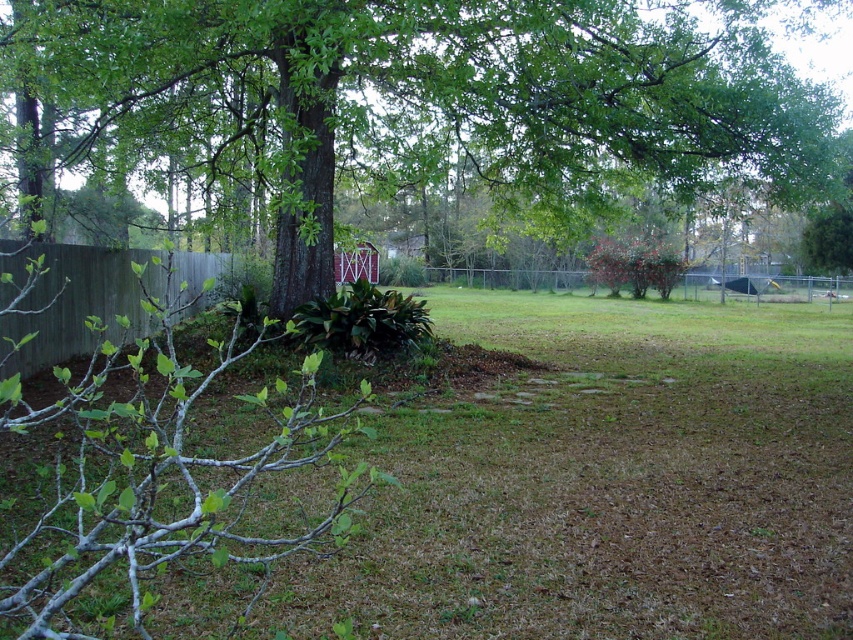
Who is shorter, green grass at lower center or metallic chain-link fence at center-right?

Standing shorter between the two is green grass at lower center.

Is point (819, 564) behind point (733, 292)?

No, it is in front of (733, 292).

Is point (440, 477) farther from viewer compared to point (549, 272)?

No, it is in front of (549, 272).

Identify the location of green grass at lower center. (604, 483).

Does point (379, 563) come closer to viewer compared to point (683, 140)?

Yes, point (379, 563) is in front of point (683, 140).

At what (x,y) coordinates should I click in order to perform the action: click on green grass at lower center. Please return your answer as a coordinate pair (x, y). The height and width of the screenshot is (640, 853). Looking at the image, I should click on (604, 483).

Who is positioned more to the right, green leafy tree at center or gray wood fence at left?

green leafy tree at center is more to the right.

Does green leafy tree at center appear under gray wood fence at left?

No.

Where is `green leafy tree at center`? The width and height of the screenshot is (853, 640). green leafy tree at center is located at coordinates (434, 97).